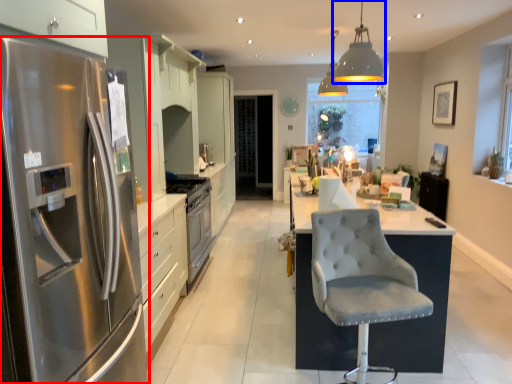
Question: Which of the following is the farthest to the observer, refrigerator (highlighted by a red box) or light fixture (highlighted by a blue box)?

Choices:
 (A) refrigerator
 (B) light fixture

Answer: (B)